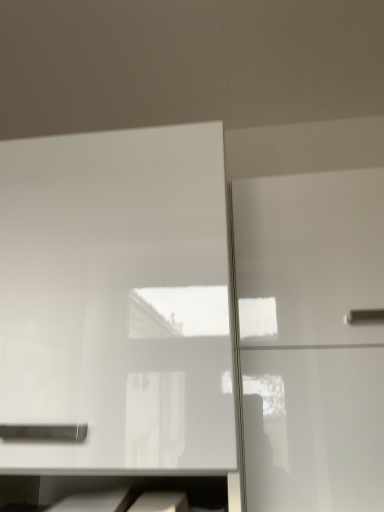
Question: Is white glossy cabinet at upper left, the first cabinetry viewed from the left, in front of or behind glossy white cabinet at right, which is counted as the 1th cabinetry, starting from the right, in the image?

Choices:
 (A) front
 (B) behind

Answer: (A)

Question: From the image's perspective, relative to glossy white cabinet at right, which is counted as the 1th cabinetry, starting from the right, is white glossy cabinet at upper left, the first cabinetry viewed from the left, above or below?

Choices:
 (A) above
 (B) below

Answer: (A)

Question: Would you say white glossy cabinet at upper left, the first cabinetry viewed from the left, is inside or outside glossy white cabinet at right, which is counted as the 1th cabinetry, starting from the right?

Choices:
 (A) outside
 (B) inside

Answer: (A)

Question: From the image's perspective, relative to white glossy cabinet at upper left, positioned as the 2th cabinetry in right-to-left order, is glossy white cabinet at right, the 2th cabinetry when ordered from left to right, above or below?

Choices:
 (A) below
 (B) above

Answer: (A)

Question: Is glossy white cabinet at right, which is counted as the 1th cabinetry, starting from the right, inside or outside of white glossy cabinet at upper left, the first cabinetry viewed from the left?

Choices:
 (A) outside
 (B) inside

Answer: (A)

Question: Considering the positions of glossy white cabinet at right, which is counted as the 1th cabinetry, starting from the right, and white glossy cabinet at upper left, positioned as the 2th cabinetry in right-to-left order, in the image, is glossy white cabinet at right, which is counted as the 1th cabinetry, starting from the right, wider or thinner than white glossy cabinet at upper left, positioned as the 2th cabinetry in right-to-left order,?

Choices:
 (A) thin
 (B) wide

Answer: (A)

Question: Is glossy white cabinet at right, the 2th cabinetry when ordered from left to right, bigger or smaller than white glossy cabinet at upper left, positioned as the 2th cabinetry in right-to-left order?

Choices:
 (A) small
 (B) big

Answer: (A)